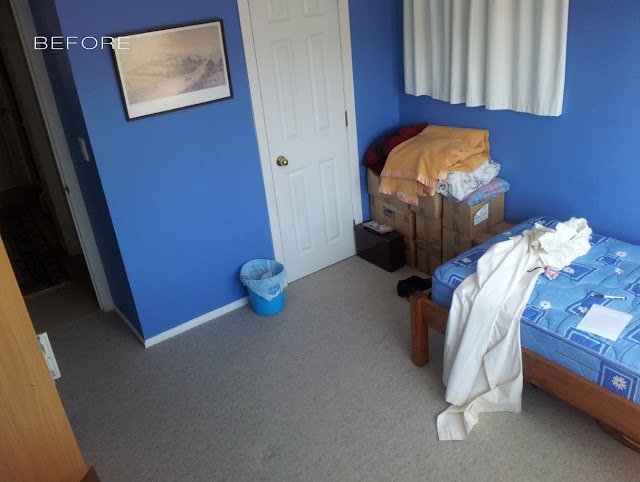
Identify the location of wooden bed frame. (573, 400).